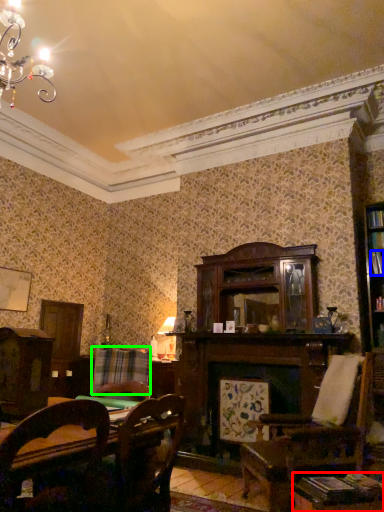
Question: Considering the real-world distances, which object is farthest from table (highlighted by a red box)? book (highlighted by a blue box) or plaid (highlighted by a green box)?

Choices:
 (A) book
 (B) plaid

Answer: (B)